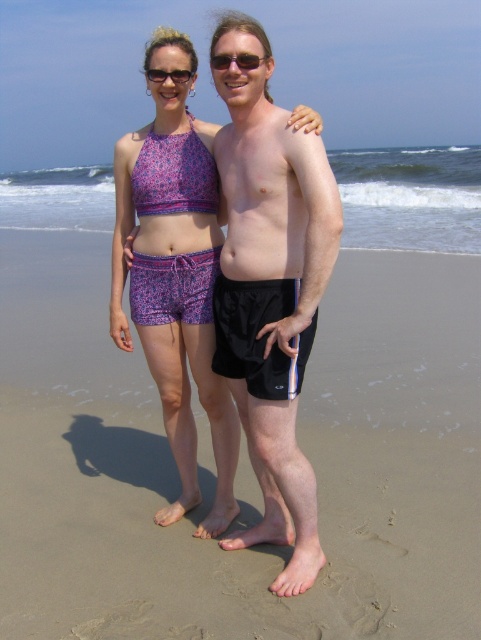
Consider the image. You are standing at the camera position and want to throw a seashell to both the point at coordinates point (21, 573) and point (151, 188). Which point should you aim for first if you want to reach the closer one first?

You should aim for point (21, 573) first because it is closer to the camera than point (151, 188).

You are a photographer standing at the camera position. You want to take a photo focusing on the two points marked in the image. Which point, point [265,54] or point [163,76], is closer to your camera position?

Point [265,54] is closer to the camera than point [163,76].